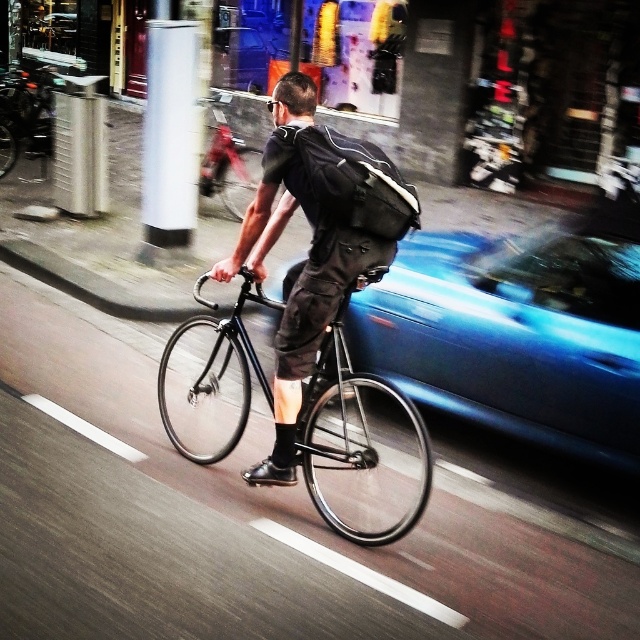
You are a photographer trying to capture a cyclist on a shiny black bicycle at center. You want to ensure the bicycle is the main focus of your photo. Given that the bicycle is 3.60 meters away from the camera, what should you adjust to make sure it appears sharp and in focus?

To ensure the shiny black bicycle at center appears sharp and in focus, you should adjust the camera focus to a distance of 3.60 meters, matching the bicycle

You are a delivery person on a bicycle in an urban area. You notice two points marked in the scene. The first point is at coordinates point (332,161) and the second is at point (172,52). Which of these two points is closer to your current position as you move forward?

Point (172,52) is closer to your current position because it is behind point (332,161), which is in front of it.